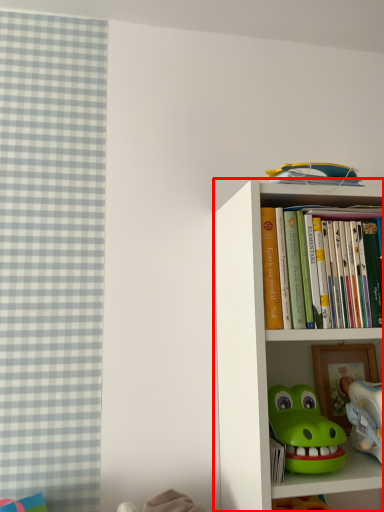
Question: From the image's perspective, where is bookcase (annotated by the red box) located relative to toy?

Choices:
 (A) above
 (B) below

Answer: (A)